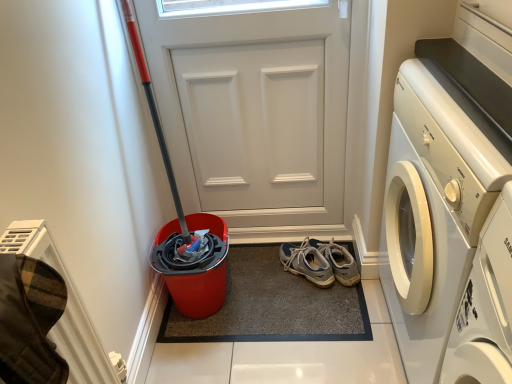
Question: Is white matte door at center taller or shorter than white glossy washing machine at right?

Choices:
 (A) short
 (B) tall

Answer: (B)

Question: Is white matte door at center inside the boundaries of white glossy washing machine at right, or outside?

Choices:
 (A) inside
 (B) outside

Answer: (B)

Question: Based on their relative distances, which object is nearer to the light blue suede sneakers at center?

Choices:
 (A) white glossy washing machine at right
 (B) carpeted mat at center
 (C) white matte door at center

Answer: (B)

Question: Based on their relative distances, which object is nearer to the light blue suede sneakers at center?

Choices:
 (A) white glossy washing machine at right
 (B) white matte door at center
 (C) carpeted mat at center

Answer: (C)